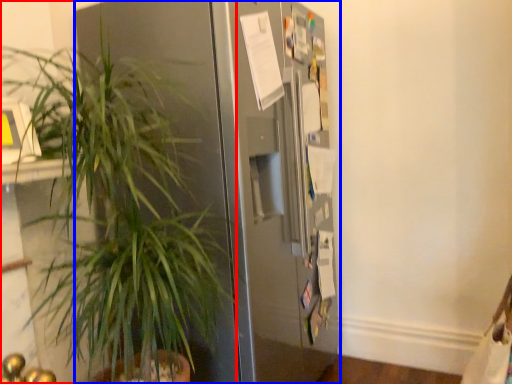
Question: Among these objects, which one is farthest to the camera, houseplant (highlighted by a red box) or refrigerator (highlighted by a blue box)?

Choices:
 (A) houseplant
 (B) refrigerator

Answer: (B)